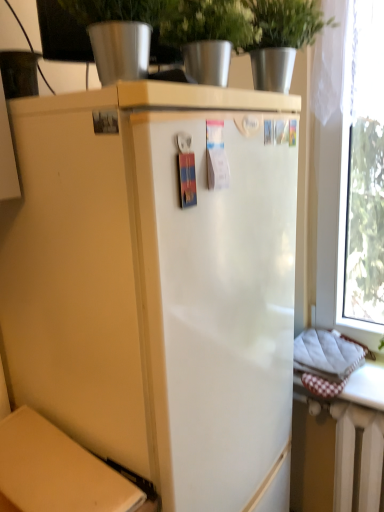
Question: In terms of size, does transparent glass window at right appear bigger or smaller than matte cardboard box at lower left?

Choices:
 (A) small
 (B) big

Answer: (B)

Question: Does point (380, 276) appear closer or farther from the camera than point (64, 442)?

Choices:
 (A) farther
 (B) closer

Answer: (A)

Question: Estimate the real-world distances between objects in this image. Which object is closer to the matte cardboard box at lower left?

Choices:
 (A) white painted metal radiator at lower right
 (B) metallic silver pot at upper center
 (C) transparent glass window at right

Answer: (A)

Question: Estimate the real-world distances between objects in this image. Which object is closer to the metallic silver pot at upper center?

Choices:
 (A) transparent glass window at right
 (B) white painted metal radiator at lower right
 (C) matte cardboard box at lower left

Answer: (A)